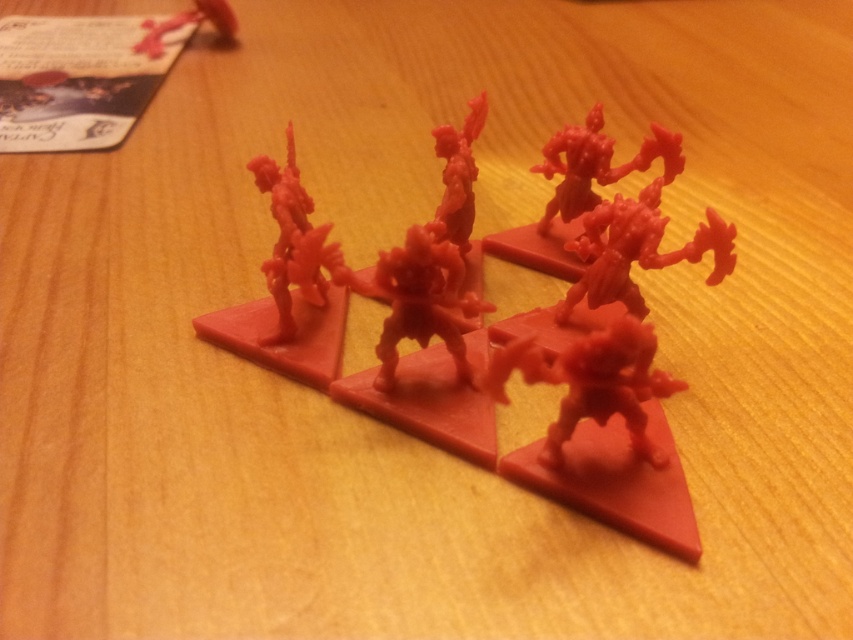
You are a collector who wants to place a new 1.5 meter wide shelf in your collection room. You have two existing toys, the matte plastic toy at center and the matte plastic toy at upper left. Can you fit both toys on the shelf without overlapping?

The distance between the matte plastic toy at center and the matte plastic toy at upper left is 1.23 meters, which is less than the 1.5 meter width of the shelf. Therefore, both toys can fit on the shelf without overlapping.

You are a collector organizing a display of miniature figurines on a wooden table. You have a new matte plastic toy that needs to be placed exactly at the center of the table. The coordinates given are point [538,369]. Can you confirm if placing the matte plastic toy at this point will position it at the center of the table?

Point [538,369] corresponds to the matte plastic toy at center, so yes, placing the matte plastic toy at this point will position it at the center of the table.

You are positioning a camera to capture the matte plastic miniature at center for a product photo. The camera is set up at point A. To ensure the miniature is in the frame, where should you place the camera relative to the miniature? Please consider the coordinates provided in the description.

The matte plastic miniature at center is located at point coordinates (293, 241). To ensure it is in the frame, the camera should be positioned facing towards these coordinates from a suitable distance and angle that keeps the miniature within the camera view.